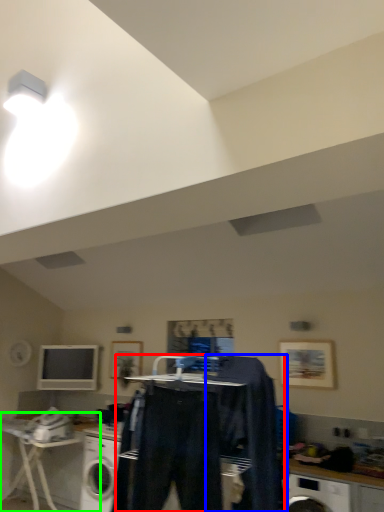
Question: Considering the real-world distances, which object is closest to clothing (highlighted by a red box)? clothing (highlighted by a blue box) or table (highlighted by a green box).

Choices:
 (A) clothing
 (B) table

Answer: (A)